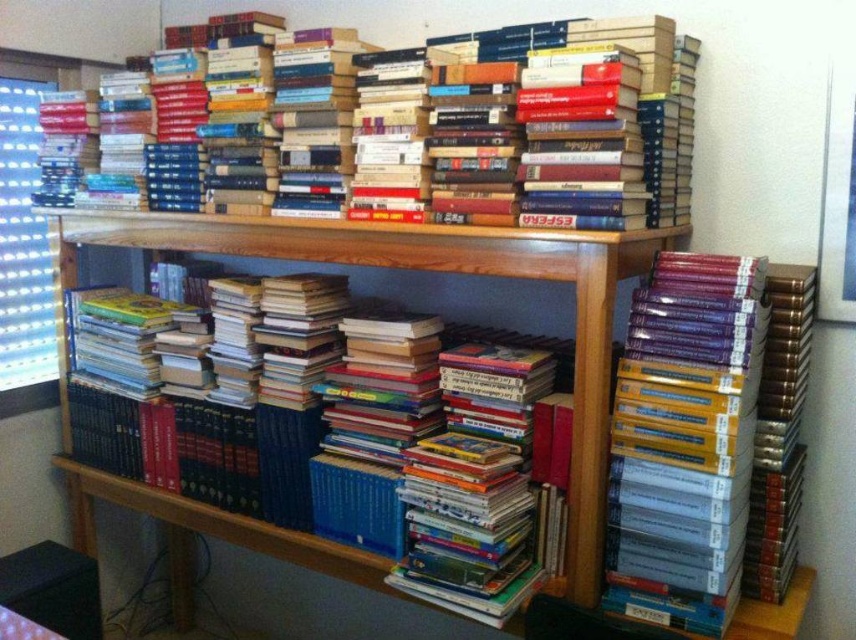
Question: From the image, what is the correct spatial relationship of hardcover books at upper center in relation to wooden bookshelf at center?

Choices:
 (A) left
 (B) right

Answer: (B)

Question: Among these objects, which one is farthest from the camera?

Choices:
 (A) hardcover books at upper center
 (B) wooden bookshelf at center

Answer: (A)

Question: Is hardcover books at upper center wider than wooden bookshelf at center?

Choices:
 (A) yes
 (B) no

Answer: (B)

Question: From the image, what is the correct spatial relationship of hardcover books at upper center in relation to wooden bookshelf at center?

Choices:
 (A) right
 (B) left

Answer: (A)

Question: Which point is farther to the camera?

Choices:
 (A) (522, 252)
 (B) (587, 129)

Answer: (A)